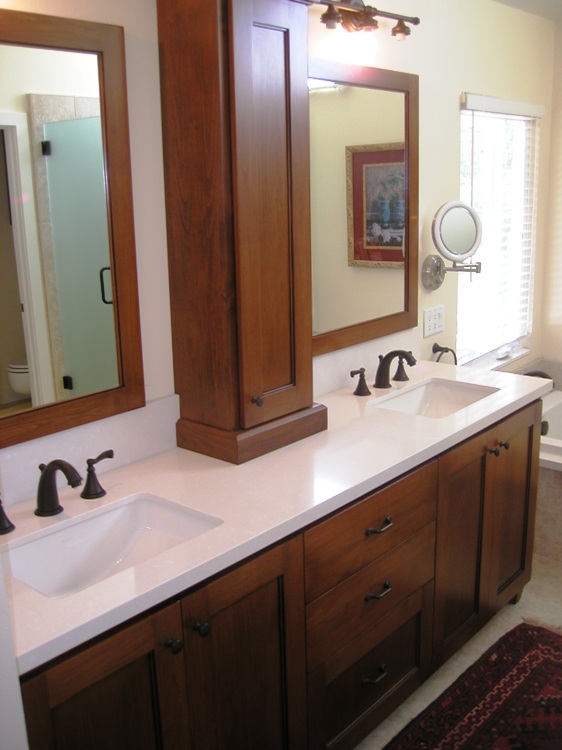
Identify the location of light fixture. The height and width of the screenshot is (750, 562). (366, 15).